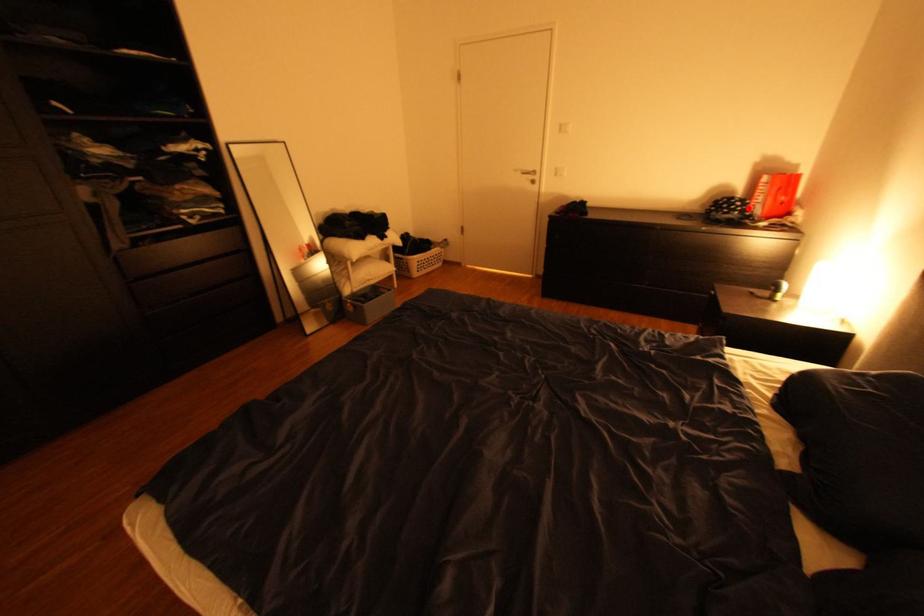
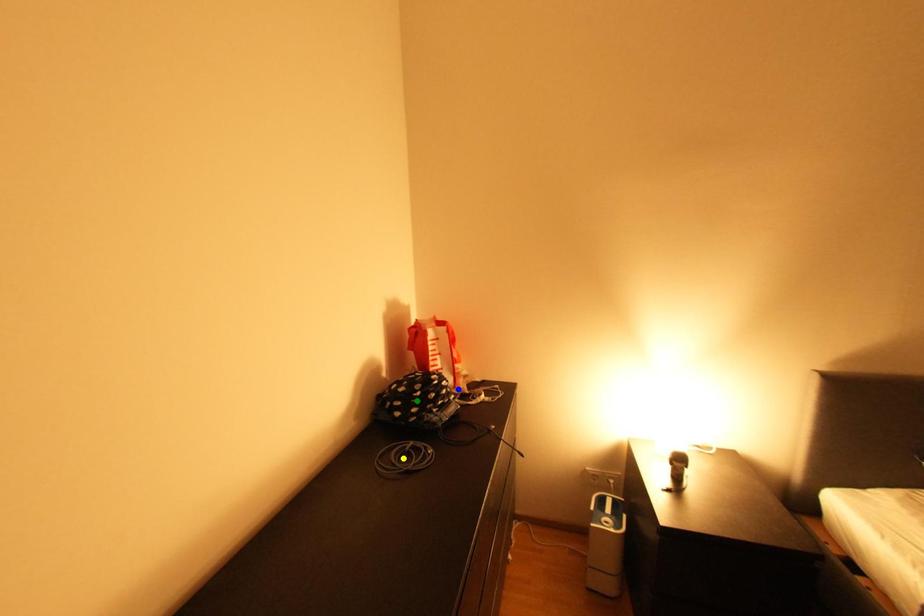
Question: I am providing you with two images of the same scene from different viewpoints. A red point is marked on the first image. You are given multiple points on the second image. In image 2, which mark is for the same physical point as the one in image 1?

Choices:
 (A) blue point
 (B) yellow point
 (C) green point

Answer: (A)